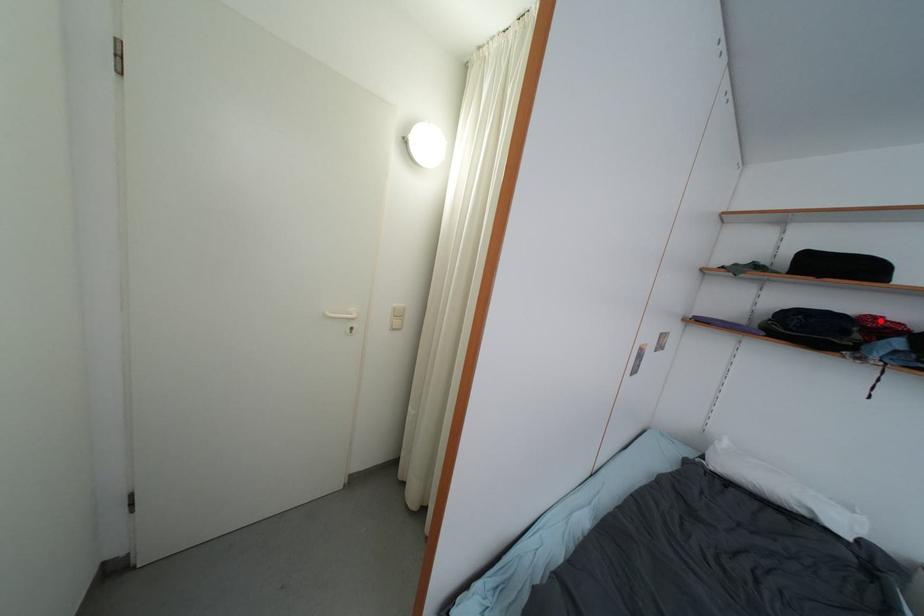
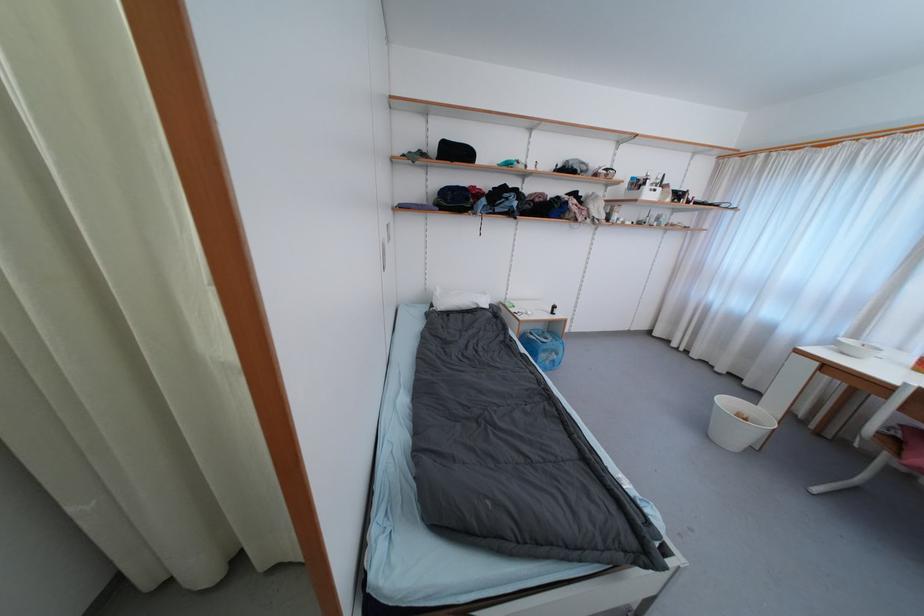
Question: I am providing you with two images of the same scene from different viewpoints. A red point is shown in image1. For the corresponding object point in image2, is it positioned nearer or farther from the camera?

Choices:
 (A) Nearer
 (B) Farther

Answer: (A)